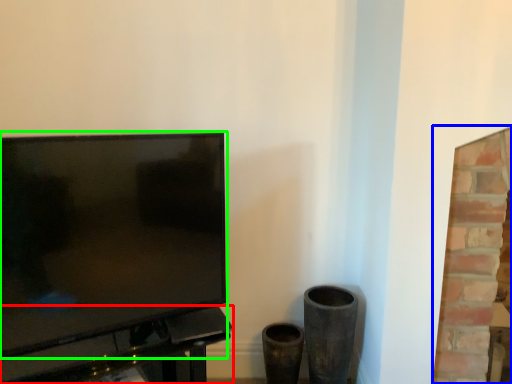
Question: Which object is positioned closest to table (highlighted by a red box)? Select from fireplace (highlighted by a blue box) and television (highlighted by a green box).

Choices:
 (A) fireplace
 (B) television

Answer: (B)